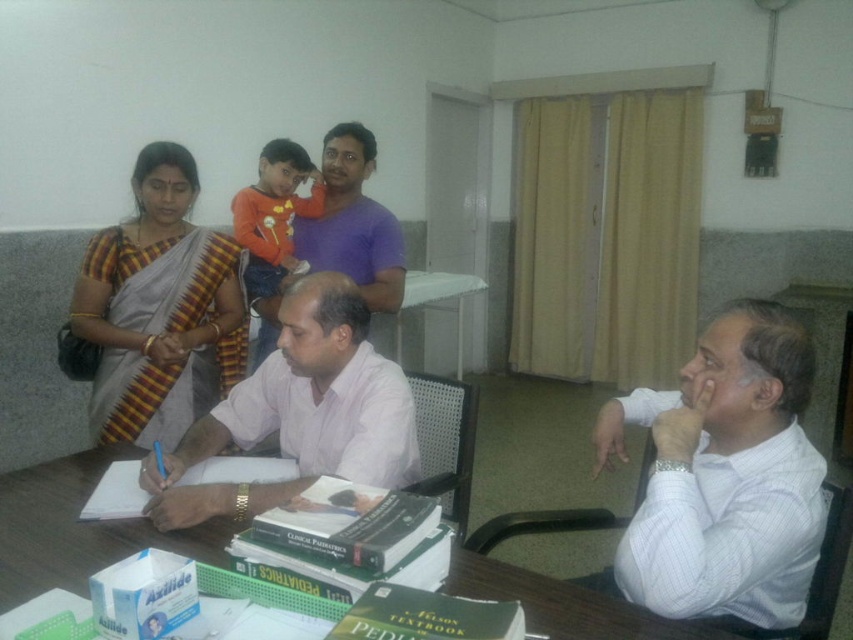
You are standing in the meeting room and need to locate the white striped shirt at lower right and the pink shirt at center. According to the spatial arrangement, which one is positioned to the right of the other?

The white striped shirt at lower right is to the right of the pink shirt at center.

You are standing in the room and want to reach the point at coordinates (289, 403). The door is behind you. Can you walk straight ahead to get there without turning?

The point at coordinates (289, 403) is 1.85 meters away from you. Since the door is behind you, walking straight ahead would move you toward that point, so yes, you can walk straight ahead to reach it without turning.

You are a delivery person standing outside the room and want to hand a package to the person wearing the pink shirt at center. The door is partially covered by a beige curtain on the right. Can you reach them without entering the room?

The pink shirt at center is 1.39 meters away from the viewer. Since the door is partially covered by a beige curtain on the right, you might not be able to reach them without entering the room as the distance is too far and the curtain may block access.